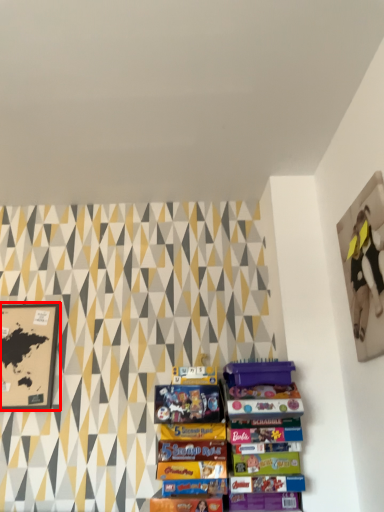
Question: From the image, what is the correct spatial relationship of picture frame (annotated by the red box) in relation to picture frame?

Choices:
 (A) left
 (B) right

Answer: (A)